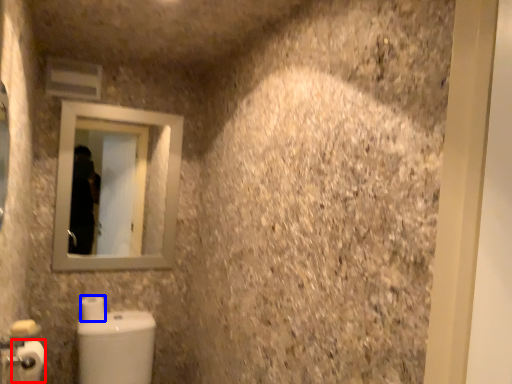
Question: Which object appears closest to the camera in this image, toilet paper (highlighted by a red box) or toilet paper (highlighted by a blue box)?

Choices:
 (A) toilet paper
 (B) toilet paper

Answer: (A)